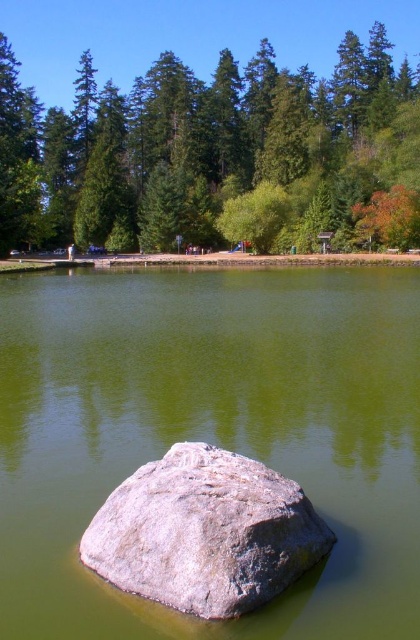
Question: Observing the image, what is the correct spatial positioning of smooth gray rock at center in reference to green matte tree at upper center?

Choices:
 (A) below
 (B) above

Answer: (A)

Question: Which point appears closest to the camera in this image?

Choices:
 (A) (241, 99)
 (B) (244, 566)

Answer: (B)

Question: Among these objects, which one is farthest from the camera?

Choices:
 (A) smooth gray rock at center
 (B) gray rough rock at center

Answer: (A)

Question: Among these objects, which one is farthest from the camera?

Choices:
 (A) green matte tree at upper center
 (B) smooth gray rock at center

Answer: (A)

Question: Can you confirm if smooth gray rock at center is positioned above gray rough rock at center?

Choices:
 (A) no
 (B) yes

Answer: (B)

Question: Does smooth gray rock at center appear over gray rough rock at center?

Choices:
 (A) no
 (B) yes

Answer: (B)